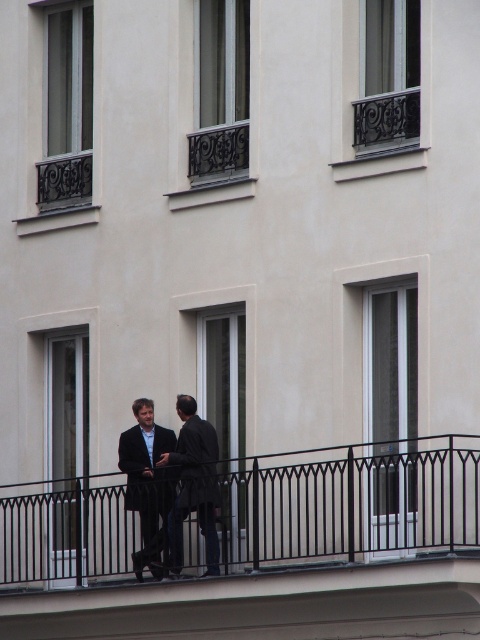
Is dark gray coat at center bigger than dark blue wool suit at center?

Yes, dark gray coat at center is bigger than dark blue wool suit at center.

Is point (168, 529) positioned behind point (164, 470)?

No, (168, 529) is in front of (164, 470).

At what (x,y) coordinates should I click in order to perform the action: click on dark gray coat at center. Please return your answer as a coordinate pair (x, y). Image resolution: width=480 pixels, height=640 pixels. Looking at the image, I should click on (180, 481).

Which is in front, point (402, 609) or point (206, 566)?

Point (402, 609) is more forward.

Find the location of `black metal railing at center`. black metal railing at center is located at coordinates (261, 548).

Between black metal railing at center and dark blue wool suit at center, which one has more height?

black metal railing at center

Is point (404, 524) less distant than point (137, 484)?

Yes, it is.

Locate an element on the screen. black metal railing at center is located at coordinates (261, 548).